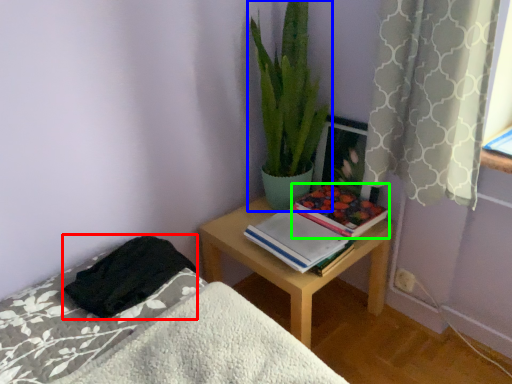
Question: Which is farther away from blanket (highlighted by a red box)? houseplant (highlighted by a blue box) or paperback book (highlighted by a green box)?

Choices:
 (A) houseplant
 (B) paperback book

Answer: (A)